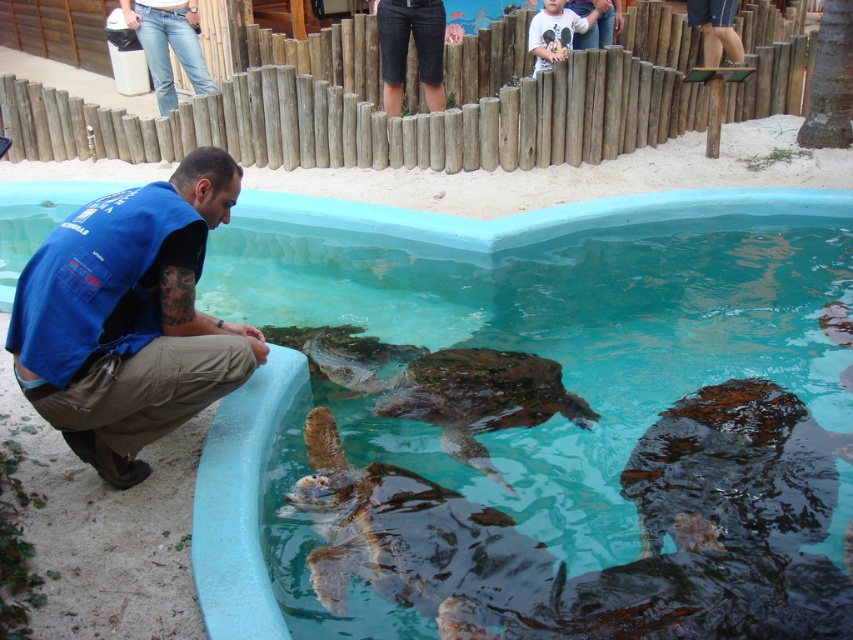
You are a visitor at the marine exhibit and want to take a photo of the blue fabric vest at lower left and the smooth concrete pool at center in the same frame. Your camera has a maximum focus range of 2.5 meters. Can you capture both objects in one shot without moving your position?

The blue fabric vest at lower left is 2.45 meters from the smooth concrete pool at center. Since the distance is within the camera maximum focus range of 2.5 meters, you can capture both objects in one shot without moving your position.

You are a visitor at the marine exhibit and want to take a photo of the brown rough textured tortoise at center without including the dark blue shirt at upper right in the frame. Is the tortoise positioned in a way that allows this?

The brown rough textured tortoise at center is closer to the viewer than the dark blue shirt at upper right, so yes, you can take a photo of the brown rough textured tortoise at center without including the dark blue shirt at upper right by focusing on the foreground where the tortoise is located.